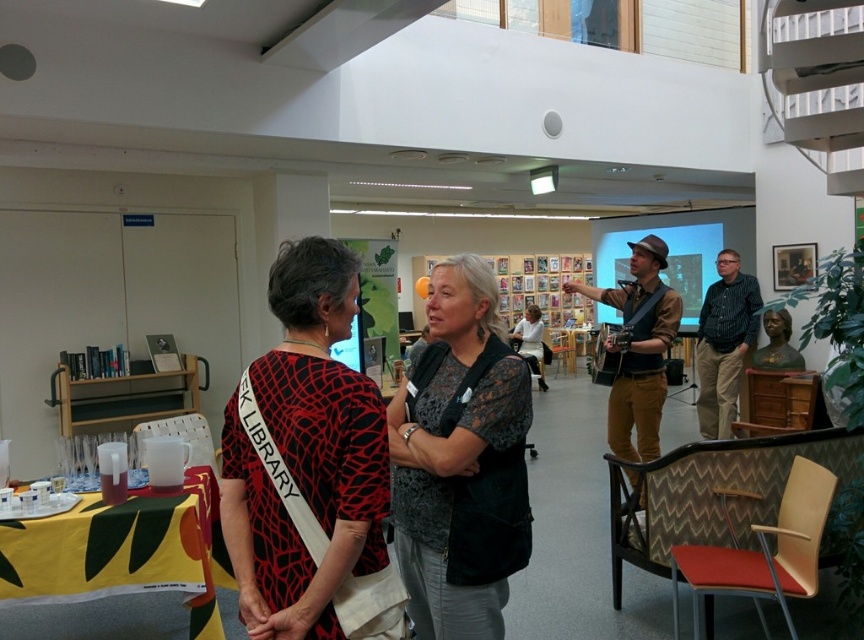
Looking at this image, you are a photographer trying to capture both the red and black printed blouse at center and the dark gray lace blouse at center in a single frame. Given that your camera has a minimum focus distance of 16 inches, will you be able to focus on both subjects simultaneously?

The red and black printed blouse at center and the dark gray lace blouse at center are 16.57 inches apart. Since the distance between them is greater than the camera minimum focus distance of 16 inches, the photographer can focus on both subjects simultaneously.

Consider the image. You are standing at point (305, 454) in the library. What clothing item is located exactly at this point?

The red and black printed blouse at center is located exactly at point (305, 454).

You are organizing a photoshoot and need to place two models wearing the red and black printed blouse at center and the dark gray lace blouse at center side by side. Based on their sizes, which model should stand closer to the camera to maintain a balanced composition?

The red and black printed blouse at center has a lesser width compared to the dark gray lace blouse at center. To maintain a balanced composition, the model wearing the red and black printed blouse at center should stand closer to the camera so that their apparent sizes appear more similar.